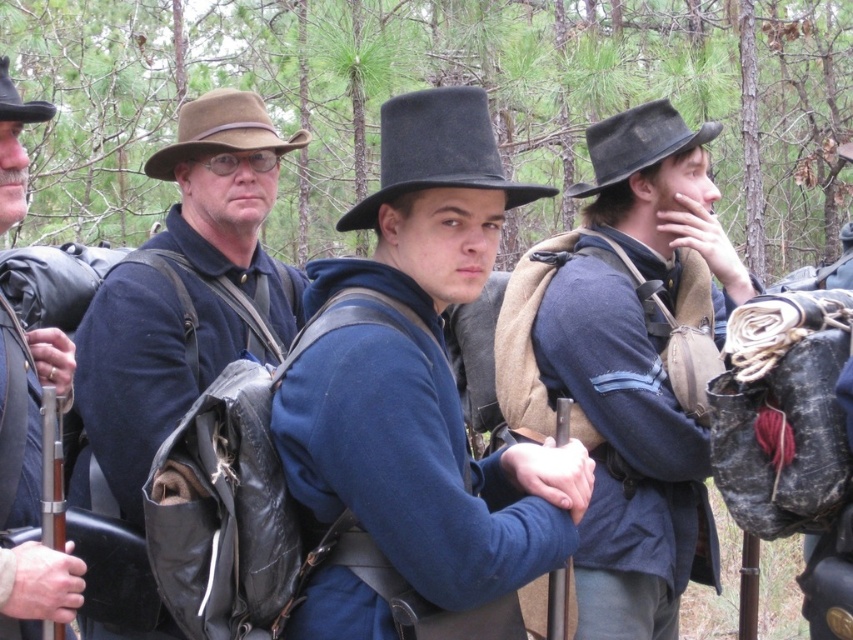
Consider the image. Measure the distance between matte black backpack at center and brown felt cowboy hat at upper left.

They are 4.48 feet apart.

Who is more distant from viewer, (218,324) or (15,97)?

Positioned behind is point (218,324).

Who is more distant from viewer, (107, 419) or (9, 88)?

The point (107, 419) is more distant.

Where is `matte black backpack at center`? The height and width of the screenshot is (640, 853). matte black backpack at center is located at coordinates (184, 292).

Which of these two, matte black rifle at left or brown felt cowboy hat at upper left, stands shorter?

With less height is brown felt cowboy hat at upper left.

The width and height of the screenshot is (853, 640). What do you see at coordinates (26, 413) in the screenshot?
I see `matte black rifle at left` at bounding box center [26, 413].

Which is behind, point (13, 358) or point (26, 104)?

Point (26, 104)

This screenshot has width=853, height=640. I want to click on matte black rifle at left, so click(26, 413).

Who is positioned more to the left, matte blue shirt at center or wooden smooth rifle at left?

wooden smooth rifle at left is more to the left.

Which is behind, point (320, 461) or point (55, 500)?

Point (320, 461)

Locate an element on the screen. Image resolution: width=853 pixels, height=640 pixels. matte blue shirt at center is located at coordinates (424, 376).